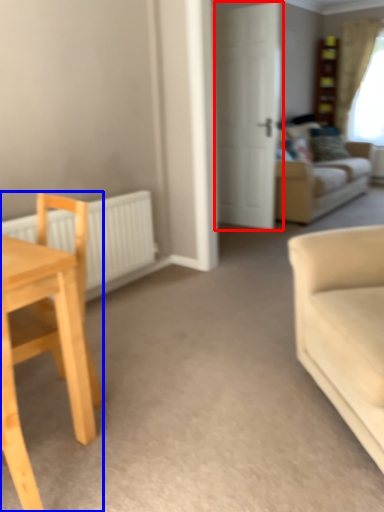
Question: Which of the following is the farthest to the observer, door (highlighted by a red box) or chair (highlighted by a blue box)?

Choices:
 (A) door
 (B) chair

Answer: (A)